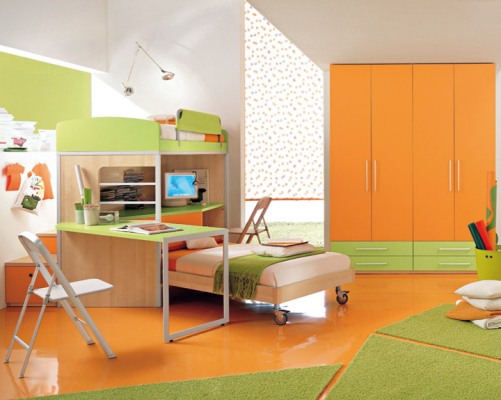
Identify the location of wheels on bottom of bed. (282, 315), (341, 297).